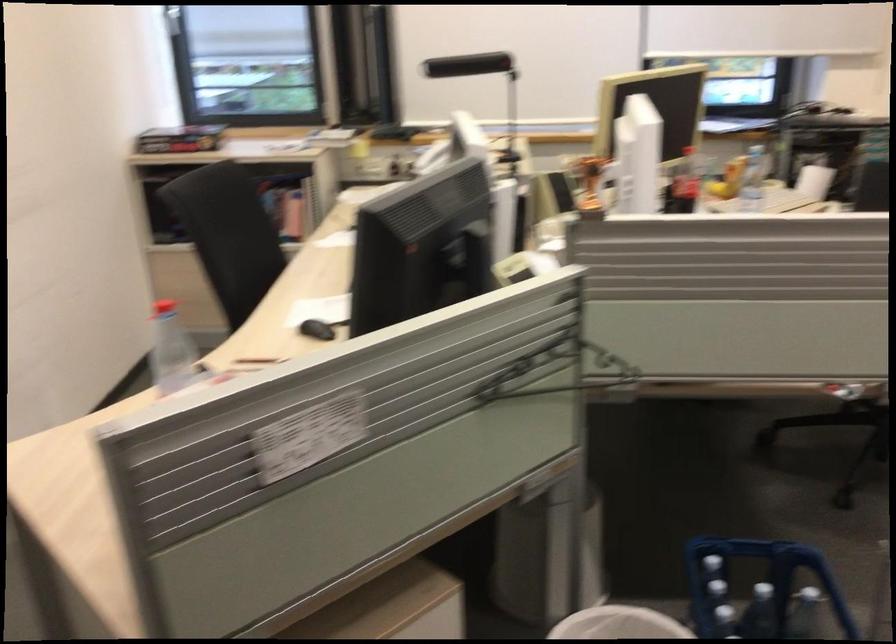
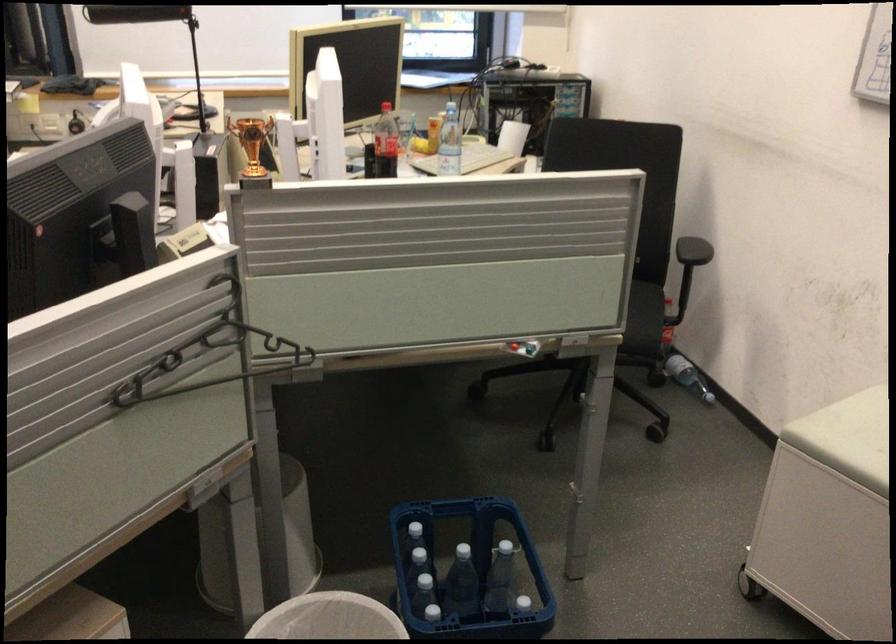
In the second image, find the point that corresponds to the point at 686,184 in the first image.

(385, 143)